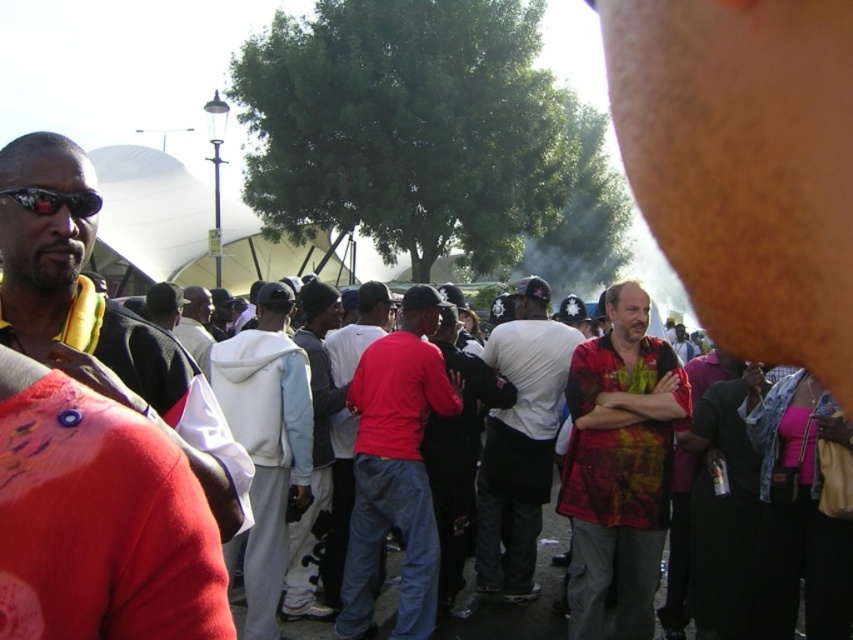
You are organizing a clothing display and need to arrange the printed cotton shirt at center and the red matte shirt at center based on their sizes. Which shirt should be placed first if you want to arrange them from smallest to largest?

The printed cotton shirt at center has a smaller size compared to the red matte shirt at center, so you should place the printed cotton shirt at center first when arranging from smallest to largest.

You are at the event and want to locate the matte red shirt at center. Which direction should you look relative to the matte black sunglasses at left?

The matte red shirt at center is to the right of the matte black sunglasses at left, so you should look to the right direction from the matte black sunglasses at left to find it.